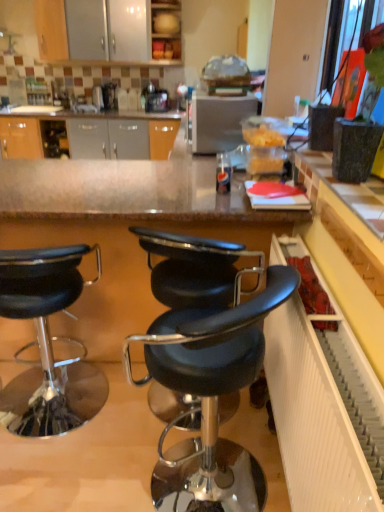
Describe the element at coordinates (48, 342) in the screenshot. I see `black leather stool at left, which is the 1th chair in left-to-right order` at that location.

What is the approximate height of black leather stool at left, the 3th chair from the right?

85.88 centimeters.

Where is `satin silver toaster at center`? The width and height of the screenshot is (384, 512). satin silver toaster at center is located at coordinates (219, 121).

Identify the location of white glossy sink at upper center. (82, 105).

The height and width of the screenshot is (512, 384). I want to click on black leather stool at left, which is the 1th chair in left-to-right order, so click(48, 342).

Is white glossy sink at upper center oriented away from black leather stool at center, which ranks as the 1th chair in right-to-left order?

No, white glossy sink at upper center is not facing the opposite direction of black leather stool at center, which ranks as the 1th chair in right-to-left order.

From the image's perspective, is white glossy sink at upper center located above or below black leather stool at center, which ranks as the 1th chair in right-to-left order?

Based on their image positions, white glossy sink at upper center is located above black leather stool at center, which ranks as the 1th chair in right-to-left order.

Is point (99, 110) farther from camera compared to point (265, 296)?

Yes, point (99, 110) is farther from viewer.

From a real-world perspective, which is physically above, white glossy sink at upper center or black leather stool at center, which ranks as the 1th chair in right-to-left order?

In real-world perspective, white glossy sink at upper center is above.

Is there a large distance between black leather stool at left, which is the 1th chair in left-to-right order, and satin silver toaster at center?

Yes.

You are a GUI agent. You are given a task and a screenshot of the screen. Output one action in this format:
    pyautogui.click(x=<x>, y=<y>)
    Task: Click on the appliance behind the black leather stool at left, the 3th chair from the right
    The height and width of the screenshot is (512, 384).
    Given the screenshot: What is the action you would take?
    pyautogui.click(x=219, y=121)

Between black leather stool at left, which is the 1th chair in left-to-right order, and satin silver toaster at center, which one is positioned in front?

black leather stool at left, which is the 1th chair in left-to-right order, is in front.

Is satin silver toaster at center completely or partially inside black leather stool at left, which is the 1th chair in left-to-right order?

No, satin silver toaster at center is located outside of black leather stool at left, which is the 1th chair in left-to-right order.

From the image's perspective, which chair is the 1st one below the satin silver toaster at center? Please provide its 2D coordinates.

[(195, 269)]

Considering the relative positions of satin silver toaster at center and black leather stool at center, which ranks as the second chair in right-to-left order, in the image provided, is satin silver toaster at center to the left or to the right of black leather stool at center, which ranks as the second chair in right-to-left order,?

Based on their positions, satin silver toaster at center is located to the right of black leather stool at center, which ranks as the second chair in right-to-left order.

In the scene shown: Which point is more forward, [229,148] or [157,409]?

Positioned in front is point [157,409].

From the image's perspective, between satin silver toaster at center and black leather stool at center, which ranks as the second chair in right-to-left order, which one is located above?

satin silver toaster at center appears higher in the image.

Measure the distance from black leather stool at left, which is the 1th chair in left-to-right order, to black leather stool at center, which ranks as the 1th chair in right-to-left order.

black leather stool at left, which is the 1th chair in left-to-right order, and black leather stool at center, which ranks as the 1th chair in right-to-left order, are 38.63 inches apart.

Who is smaller, black leather stool at left, the 3th chair from the right, or black leather stool at center, which ranks as the 1th chair in right-to-left order?

With smaller size is black leather stool at left, the 3th chair from the right.

Which object is positioned more to the left, black leather stool at left, the 3th chair from the right, or black leather stool at center, placed as the third chair when sorted from left to right?

black leather stool at left, the 3th chair from the right.

Is black leather stool at left, which is the 1th chair in left-to-right order, inside the boundaries of black leather stool at center, which ranks as the 1th chair in right-to-left order, or outside?

black leather stool at left, which is the 1th chair in left-to-right order, cannot be found inside black leather stool at center, which ranks as the 1th chair in right-to-left order.

Considering the sizes of black leather stool at center, which is counted as the 2th chair, starting from the left, and white glossy sink at upper center in the image, is black leather stool at center, which is counted as the 2th chair, starting from the left, taller or shorter than white glossy sink at upper center?

black leather stool at center, which is counted as the 2th chair, starting from the left, is taller than white glossy sink at upper center.

Where is `sink behind the black leather stool at center, which is counted as the 2th chair, starting from the left`? This screenshot has width=384, height=512. sink behind the black leather stool at center, which is counted as the 2th chair, starting from the left is located at coordinates (82, 105).

Is black leather stool at center, which ranks as the second chair in right-to-left order, facing away from white glossy sink at upper center?

black leather stool at center, which ranks as the second chair in right-to-left order, is not turned away from white glossy sink at upper center.

From a real-world perspective, is black leather stool at center, which is counted as the 2th chair, starting from the left, physically located above or below white glossy sink at upper center?

From a real-world perspective, black leather stool at center, which is counted as the 2th chair, starting from the left, is physically below white glossy sink at upper center.

Is black leather stool at center, placed as the third chair when sorted from left to right, far from black leather stool at center, which is counted as the 2th chair, starting from the left?

No, black leather stool at center, placed as the third chair when sorted from left to right, is in close proximity to black leather stool at center, which is counted as the 2th chair, starting from the left.

Looking at this image, does black leather stool at center, which ranks as the 1th chair in right-to-left order, contain black leather stool at center, which is counted as the 2th chair, starting from the left?

Definitely not — black leather stool at center, which is counted as the 2th chair, starting from the left, is not inside black leather stool at center, which ranks as the 1th chair in right-to-left order.

Looking at this image, between black leather stool at center, which ranks as the 1th chair in right-to-left order, and black leather stool at center, which is counted as the 2th chair, starting from the left, which one is positioned in front?

black leather stool at center, which ranks as the 1th chair in right-to-left order, is closer to the camera.

Looking at this image, is white glossy sink at upper center looking in the opposite direction of black leather stool at center, which is counted as the 2th chair, starting from the left?

No, white glossy sink at upper center's orientation is not away from black leather stool at center, which is counted as the 2th chair, starting from the left.

How different are the orientations of white glossy sink at upper center and black leather stool at center, which is counted as the 2th chair, starting from the left, in degrees?

The facing directions of white glossy sink at upper center and black leather stool at center, which is counted as the 2th chair, starting from the left, are 87.5 degrees apart.

Does white glossy sink at upper center have a lesser height compared to black leather stool at center, which ranks as the second chair in right-to-left order?

Indeed, white glossy sink at upper center has a lesser height compared to black leather stool at center, which ranks as the second chair in right-to-left order.

I want to click on sink located on the left of black leather stool at center, which ranks as the second chair in right-to-left order, so click(82, 105).

From the white glossy sink at upper center, count 3rd chair to the right and point to it. Please provide its 2D coordinates.

[(210, 397)]

From the satin silver toaster at center, count the 3rd chair to the left and point to it. Please provide its 2D coordinates.

[(48, 342)]

When comparing their distances from black leather stool at left, the 3th chair from the right, does black leather stool at center, which is counted as the 2th chair, starting from the left, or black leather stool at center, which ranks as the 1th chair in right-to-left order, seem closer?

Based on the image, black leather stool at center, which is counted as the 2th chair, starting from the left, appears to be nearer to black leather stool at left, the 3th chair from the right.

Estimate the real-world distances between objects in this image. Which object is further from white glossy sink at upper center, black leather stool at center, which ranks as the second chair in right-to-left order, or satin silver toaster at center?

black leather stool at center, which ranks as the second chair in right-to-left order, lies further to white glossy sink at upper center than the other object.

When comparing their distances from satin silver toaster at center, does black leather stool at center, which ranks as the 1th chair in right-to-left order, or black leather stool at left, the 3th chair from the right, seem closer?

Among the two, black leather stool at center, which ranks as the 1th chair in right-to-left order, is located nearer to satin silver toaster at center.

Estimate the real-world distances between objects in this image. Which object is closer to black leather stool at left, the 3th chair from the right, white glossy sink at upper center or satin silver toaster at center?

satin silver toaster at center lies closer to black leather stool at left, the 3th chair from the right, than the other object.

Based on their spatial positions, is satin silver toaster at center or black leather stool at center, which is counted as the 2th chair, starting from the left, further from black leather stool at left, which is the 1th chair in left-to-right order?

satin silver toaster at center is positioned further to the anchor black leather stool at left, which is the 1th chair in left-to-right order.

Which object lies further to the anchor point black leather stool at center, which ranks as the second chair in right-to-left order, satin silver toaster at center or black leather stool at center, placed as the third chair when sorted from left to right?

satin silver toaster at center is further to black leather stool at center, which ranks as the second chair in right-to-left order.

Consider the image. Considering their positions, is satin silver toaster at center positioned further to black leather stool at center, which ranks as the 1th chair in right-to-left order, than black leather stool at left, which is the 1th chair in left-to-right order?

The object further to black leather stool at center, which ranks as the 1th chair in right-to-left order, is satin silver toaster at center.

When comparing their distances from white glossy sink at upper center, does black leather stool at left, which is the 1th chair in left-to-right order, or satin silver toaster at center seem closer?

satin silver toaster at center is closer to white glossy sink at upper center.

The width and height of the screenshot is (384, 512). I want to click on appliance positioned between black leather stool at left, which is the 1th chair in left-to-right order, and white glossy sink at upper center from near to far, so click(x=219, y=121).

At what (x,y) coordinates should I click in order to perform the action: click on chair between satin silver toaster at center and black leather stool at left, the 3th chair from the right, vertically. Please return your answer as a coordinate pair (x, y). The height and width of the screenshot is (512, 384). Looking at the image, I should click on (195, 269).

Image resolution: width=384 pixels, height=512 pixels. I want to click on appliance located between black leather stool at center, which is counted as the 2th chair, starting from the left, and white glossy sink at upper center in the depth direction, so click(x=219, y=121).

Identify the location of chair between black leather stool at left, the 3th chair from the right, and white glossy sink at upper center, along the z-axis. (195, 269).